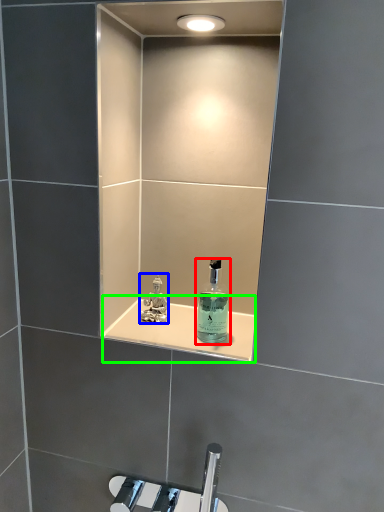
Question: Estimate the real-world distances between objects in this image. Which object is farther from bottle (highlighted by a red box), perfume (highlighted by a blue box) or shelve (highlighted by a green box)?

Choices:
 (A) perfume
 (B) shelve

Answer: (A)